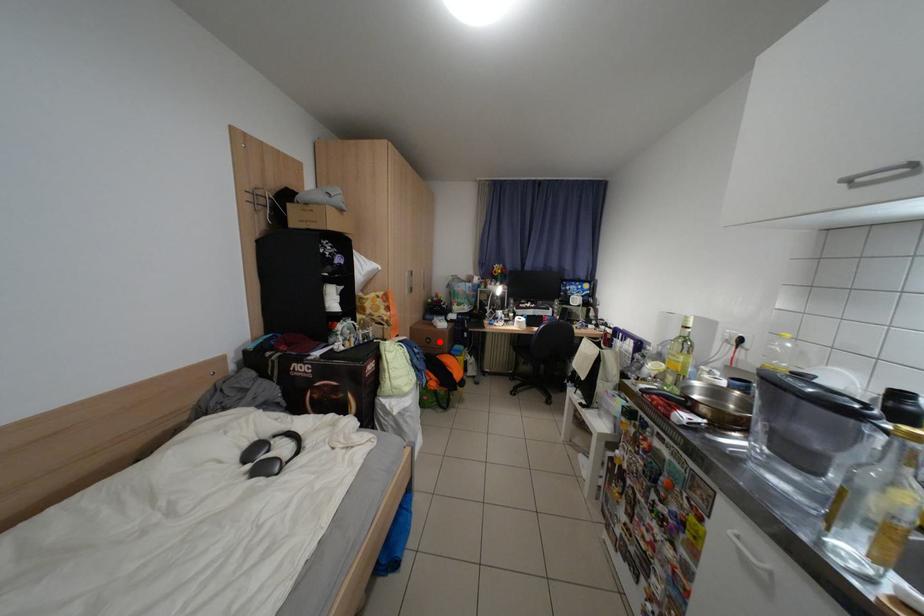
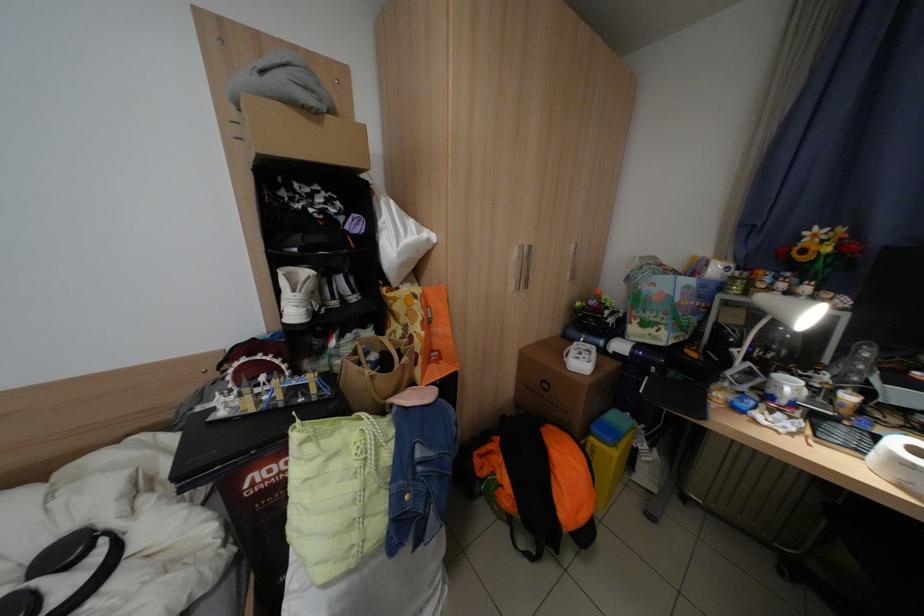
Locate, in the second image, the point that corresponds to the highlighted location in the first image.

(555, 387)